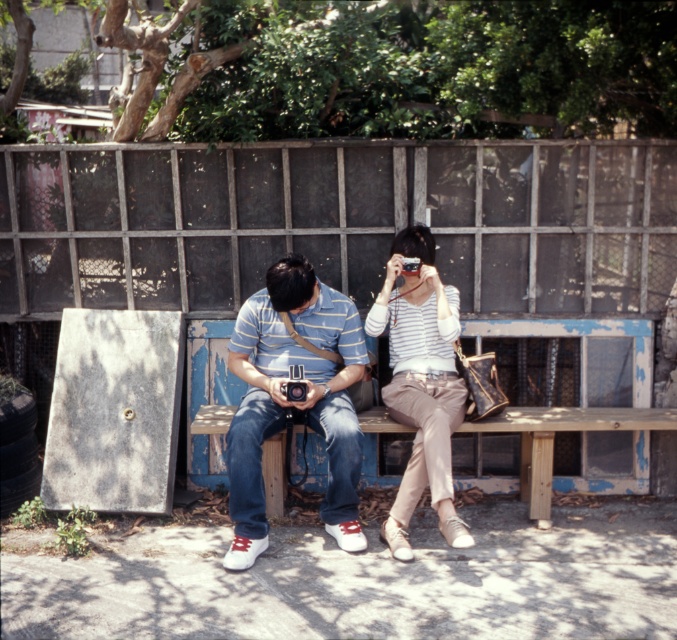
At what (x,y) coordinates should I click in order to perform the action: click on striped cotton shirt at center. Please return your answer as a coordinate pair (x, y). Looking at the image, I should click on (420, 384).

Where is `striped cotton shirt at center`? Image resolution: width=677 pixels, height=640 pixels. striped cotton shirt at center is located at coordinates (420, 384).

Locate an element on the screen. matte blue striped shirt at center is located at coordinates (292, 401).

Does matte blue striped shirt at center have a lesser height compared to striped cotton shirt at center?

Correct, matte blue striped shirt at center is not as tall as striped cotton shirt at center.

Image resolution: width=677 pixels, height=640 pixels. What are the coordinates of `matte blue striped shirt at center` in the screenshot? It's located at (292, 401).

Where is `matte blue striped shirt at center`? The width and height of the screenshot is (677, 640). matte blue striped shirt at center is located at coordinates (292, 401).

Does matte blue striped shirt at center appear on the right side of wooden bench at center?

No, matte blue striped shirt at center is not to the right of wooden bench at center.

Can you confirm if matte blue striped shirt at center is taller than wooden bench at center?

Indeed, matte blue striped shirt at center has a greater height compared to wooden bench at center.

Where is `matte blue striped shirt at center`? This screenshot has height=640, width=677. matte blue striped shirt at center is located at coordinates (292, 401).